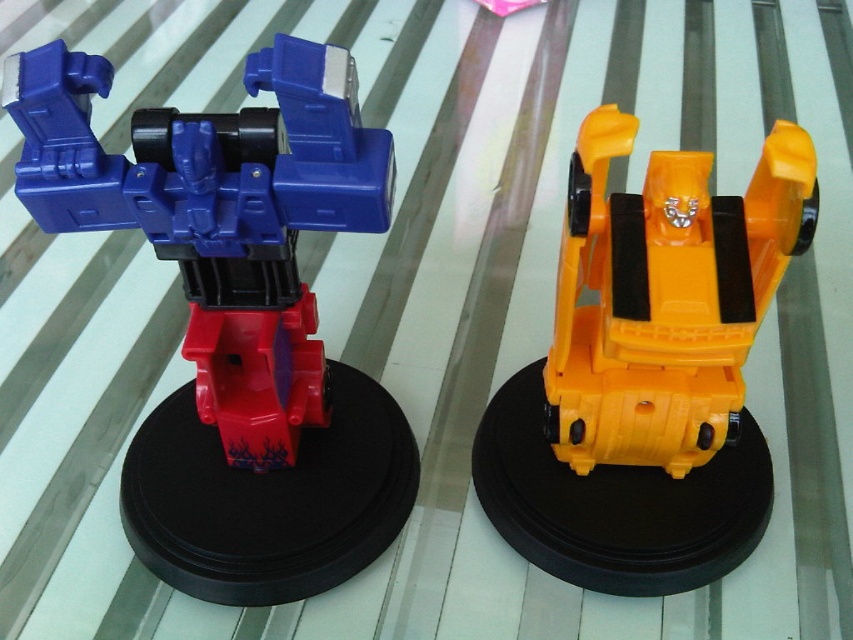
You are arranging two toy figures on a glass table. You have an orange matte plastic robot at center and a matte plastic transformer at left. Which toy is positioned more to the right side of the table?

The orange matte plastic robot at center is positioned more to the right side of the table than the matte plastic transformer at left.

You are a collector who wants to display both the orange matte plastic robot at center and the matte plastic transformer at left on a shelf. Which one should you place on the lower shelf to ensure they are visible without blocking each other?

Since the orange matte plastic robot at center is taller than the matte plastic transformer at left, you should place the taller orange matte plastic robot at center on the lower shelf so that the shorter matte plastic transformer at left can be seen above it without obstruction.

You are trying to place both the orange matte plastic robot at center and the matte plastic transformer at left on a shelf that can only hold items up to the width of the wider one. Which toy should you use to determine the shelf width limit?

The orange matte plastic robot at center is wider than the matte plastic transformer at left, so you should use the orange matte plastic robot at center to determine the shelf width limit since it is the wider one.